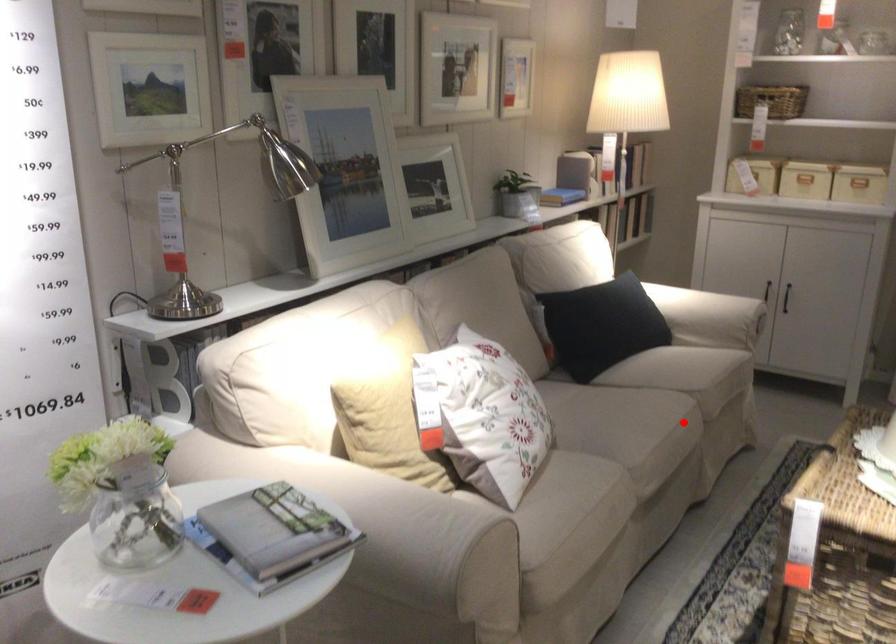
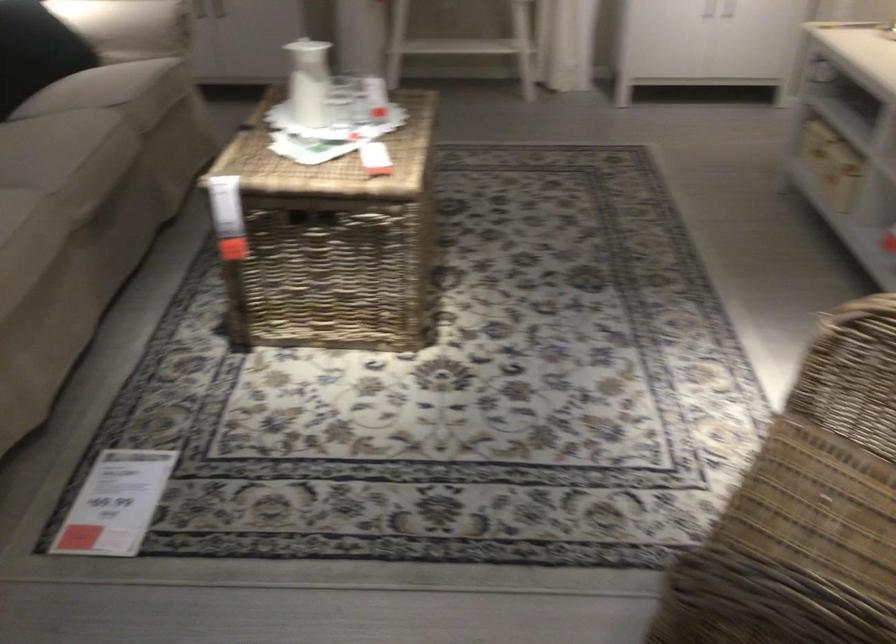
Locate, in the second image, the point that corresponds to the highlighted location in the first image.

(109, 140)